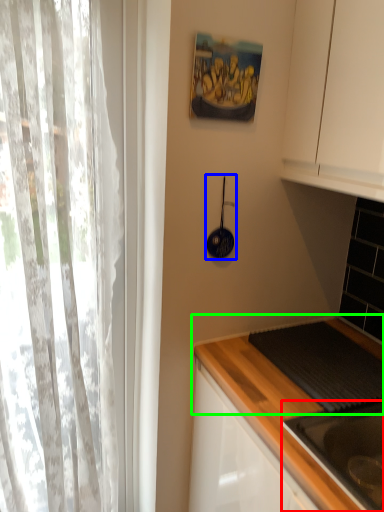
Question: Which is nearer to the sink (highlighted by a red box)? appliance (highlighted by a blue box) or countertop (highlighted by a green box).

Choices:
 (A) appliance
 (B) countertop

Answer: (B)